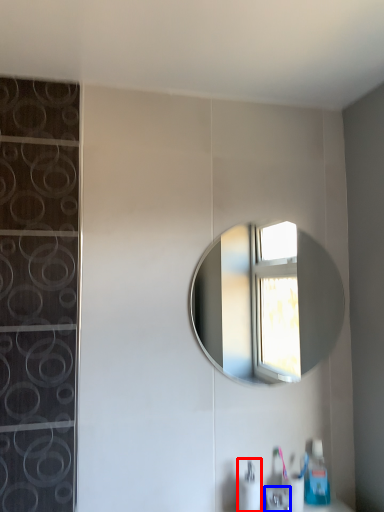
Question: Which object is further to the camera taking this photo, soap dispenser (highlighted by a red box) or faucet (highlighted by a blue box)?

Choices:
 (A) soap dispenser
 (B) faucet

Answer: (A)